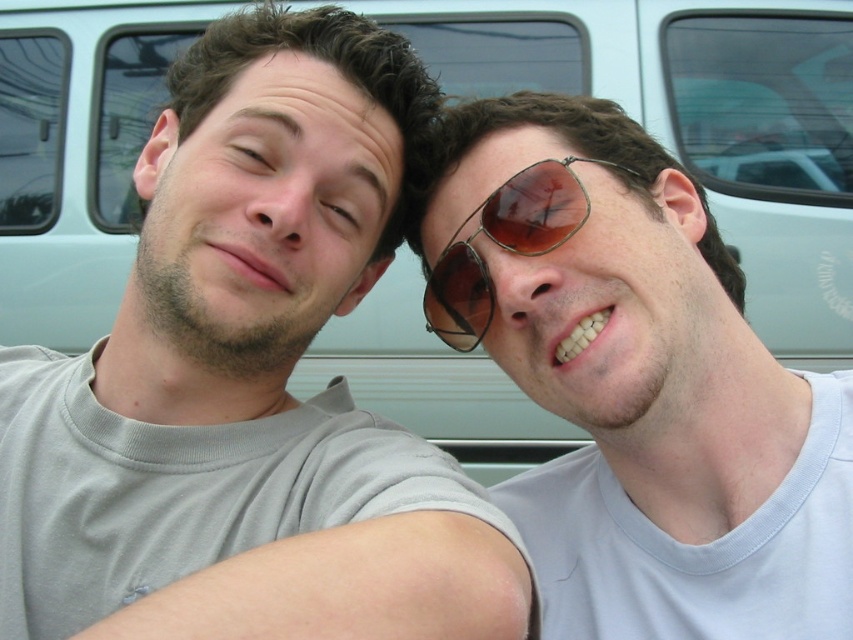
You are taking a photo of two people standing in front of a light blue vehicle. You notice two points marked in the image. One is at coordinates point (363, 60) and the other at point (234, 144). Which point is closer to you?

Point (363, 60) is further to the viewer than point (234, 144), so the point closer to you is point (234, 144).

You are a photographer trying to capture a closeup shot of both the metal aviator sunglasses at center and the matte skin at center. Given that your camera has a maximum focus range of 6 inches, will you be able to capture both subjects in focus without moving the camera or the subjects?

The metal aviator sunglasses at center and matte skin at center are 7.26 inches apart from each other. Since the camera can only focus within 6 inches, the distance between them exceeds the maximum focus range. Therefore, you cannot capture both subjects in focus without adjusting the camera or moving the subjects.